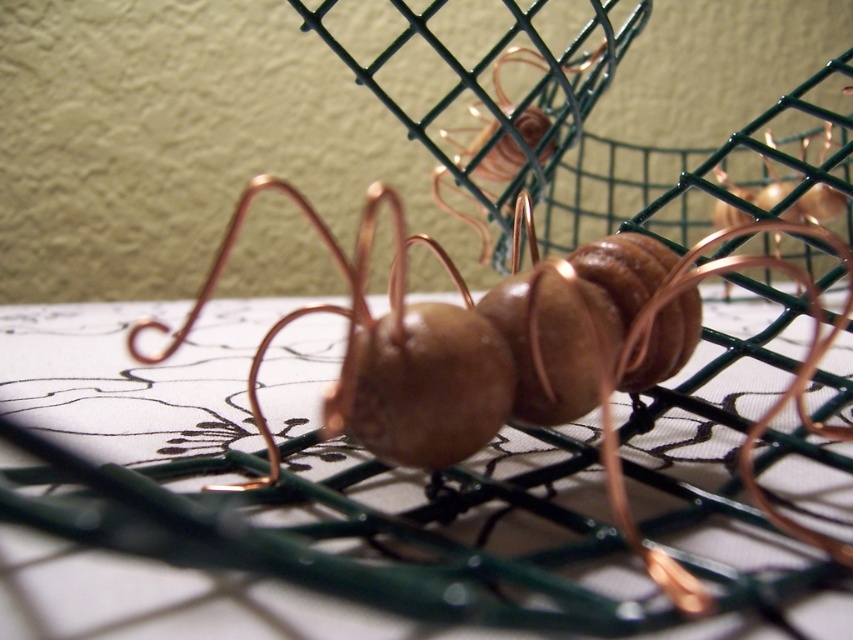
Question: Does shiny copper wire at center have a lesser width compared to copper wire ant at center?

Choices:
 (A) no
 (B) yes

Answer: (B)

Question: Observing the image, what is the correct spatial positioning of shiny copper wire at center in reference to copper wire ant at center?

Choices:
 (A) left
 (B) right

Answer: (A)

Question: Among these points, which one is farthest from the camera?

Choices:
 (A) 646,381
 (B) 766,161

Answer: (B)

Question: Is shiny copper wire at center bigger than copper wire ant at center?

Choices:
 (A) yes
 (B) no

Answer: (B)